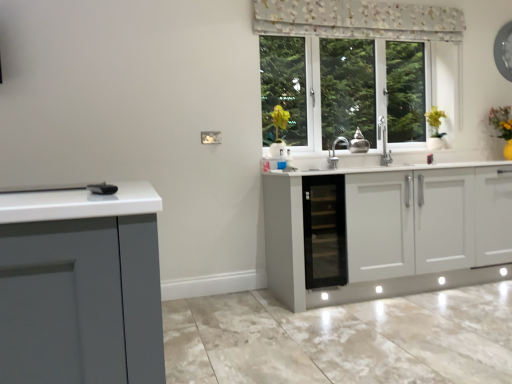
Question: Can you confirm if black glass cabinet at center is positioned to the right of yellow matte plant at upper right?

Choices:
 (A) no
 (B) yes

Answer: (A)

Question: Is black glass cabinet at center taller than yellow matte plant at upper right?

Choices:
 (A) no
 (B) yes

Answer: (B)

Question: Are black glass cabinet at center and yellow matte plant at upper right making contact?

Choices:
 (A) no
 (B) yes

Answer: (A)

Question: From a real-world perspective, is black glass cabinet at center on yellow matte plant at upper right?

Choices:
 (A) yes
 (B) no

Answer: (B)

Question: Would you say black glass cabinet at center contains yellow matte plant at upper right?

Choices:
 (A) yes
 (B) no

Answer: (B)

Question: From the image's perspective, is yellow matte plant at upper right above or below floral fabric curtain at upper center?

Choices:
 (A) above
 (B) below

Answer: (B)

Question: Is yellow matte plant at upper right wider or thinner than floral fabric curtain at upper center?

Choices:
 (A) thin
 (B) wide

Answer: (B)

Question: In the image, is yellow matte plant at upper right on the left side or the right side of floral fabric curtain at upper center?

Choices:
 (A) left
 (B) right

Answer: (B)

Question: From a real-world perspective, relative to floral fabric curtain at upper center, is yellow matte plant at upper right vertically above or below?

Choices:
 (A) above
 (B) below

Answer: (B)

Question: Relative to yellow matte plant at upper right, is floral fabric curtain at upper center in front or behind?

Choices:
 (A) behind
 (B) front

Answer: (B)

Question: From the image's perspective, relative to yellow matte plant at upper right, is floral fabric curtain at upper center above or below?

Choices:
 (A) above
 (B) below

Answer: (A)

Question: From a real-world perspective, relative to yellow matte plant at upper right, is floral fabric curtain at upper center vertically above or below?

Choices:
 (A) above
 (B) below

Answer: (A)

Question: Based on their sizes in the image, would you say floral fabric curtain at upper center is bigger or smaller than yellow matte plant at upper right?

Choices:
 (A) big
 (B) small

Answer: (B)

Question: Is black glass cabinet at center bigger or smaller than floral fabric curtain at upper center?

Choices:
 (A) big
 (B) small

Answer: (A)

Question: Is black glass cabinet at center taller or shorter than floral fabric curtain at upper center?

Choices:
 (A) tall
 (B) short

Answer: (A)